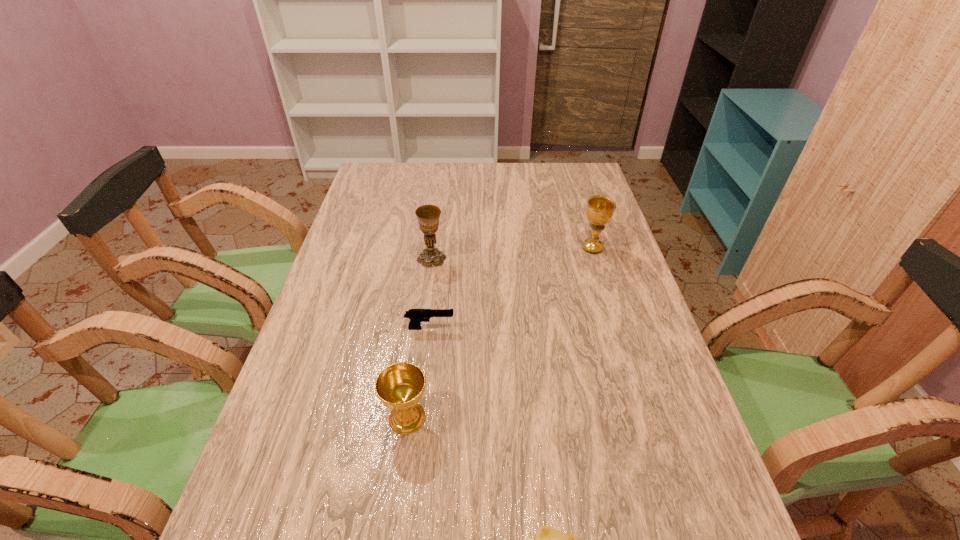
Find the location of a particular element. vacant space at the right edge of the desktop is located at coordinates (587, 274).

Locate an element on the screen. This screenshot has height=540, width=960. vacant region at the far left corner of the desktop is located at coordinates (397, 185).

Find the location of a particular element. The height and width of the screenshot is (540, 960). blank region between the pistol and the rightmost chalice is located at coordinates (512, 288).

Locate an element on the screen. vacant area that lies between the third tallest object and the rightmost object is located at coordinates (500, 333).

The height and width of the screenshot is (540, 960). Find the location of `object that is the closest to the pistol`. object that is the closest to the pistol is located at coordinates (400, 386).

Identify which object is located as the fourth nearest to the nearest object. Please provide its 2D coordinates. Your answer should be formatted as a tuple, i.e. [(x, y)], where the tuple contains the x and y coordinates of a point satisfying the conditions above.

[(600, 209)]

At what (x,y) coordinates should I click in order to perform the action: click on chalice object that ranks as the second closest to the third nearest object. Please return your answer as a coordinate pair (x, y). This screenshot has width=960, height=540. Looking at the image, I should click on (428, 216).

Locate an element on the screen. This screenshot has width=960, height=540. chalice that is the second closest to the second object from right to left is located at coordinates (428, 216).

Find the location of `free space that satisfies the following two spatial constraints: 1. on the front-facing side of the pistol; 2. on the front side of the third tallest object`. free space that satisfies the following two spatial constraints: 1. on the front-facing side of the pistol; 2. on the front side of the third tallest object is located at coordinates [420, 418].